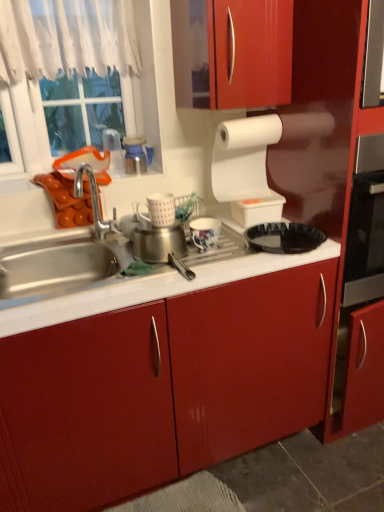
Question: From their relative heights in the image, would you say porcelain floral mug at center, the 2th appliance when ordered from right to left, is taller or shorter than black plastic tray at center?

Choices:
 (A) tall
 (B) short

Answer: (A)

Question: In terms of size, does porcelain floral mug at center, the 2th appliance when ordered from right to left, appear bigger or smaller than black plastic tray at center?

Choices:
 (A) big
 (B) small

Answer: (B)

Question: Which is farther from the white sheer curtain at upper left?

Choices:
 (A) porcelain floral mug at center, the 2th appliance when ordered from right to left
 (B) black plastic tray at center
 (C) brushed metal canister at upper center, which ranks as the 1th appliance in left-to-right order
 (D) white lace curtain at upper left
 (E) white matte paper towel at upper right

Answer: (B)

Question: Which object is the farthest from the white glossy mug at center, arranged as the 3th appliance when viewed from the right?

Choices:
 (A) black plastic tray at center
 (B) white matte paper towel at upper right
 (C) white lace curtain at upper left
 (D) white sheer curtain at upper left
 (E) porcelain floral mug at center, the 2th appliance when ordered from right to left

Answer: (D)